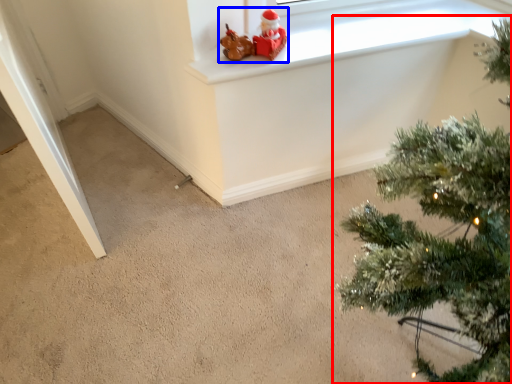
Question: Among these objects, which one is nearest to the camera, christmas tree (highlighted by a red box) or toy (highlighted by a blue box)?

Choices:
 (A) christmas tree
 (B) toy

Answer: (A)